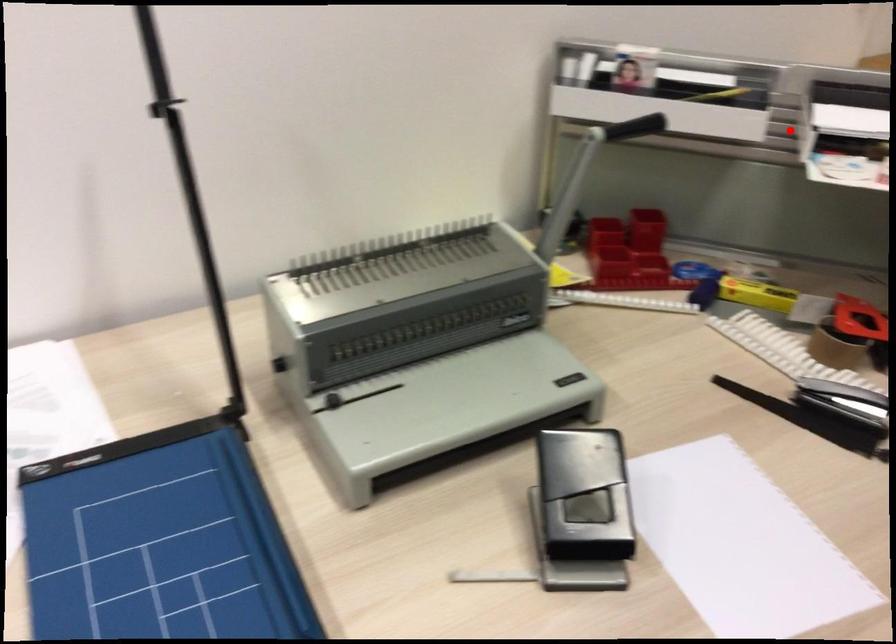
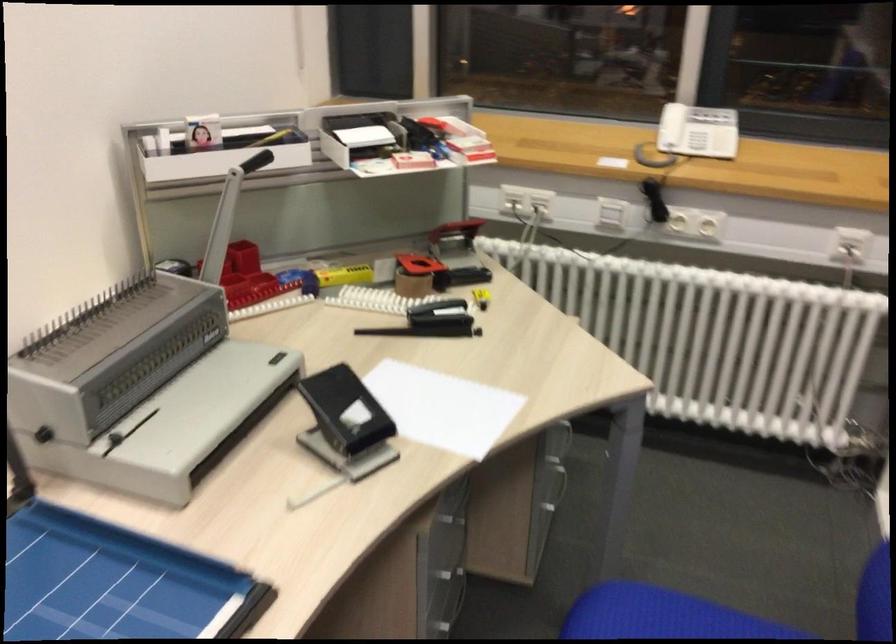
Question: I am providing you with two images of the same scene from different viewpoints. Image1 has a red point marked. In image2, the corresponding 3D location appears at what relative position? Reply with the corresponding letter.

Choices:
 (A) Closer
 (B) Farther

Answer: (B)